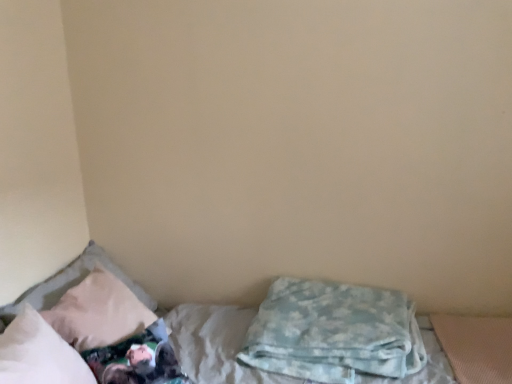
Question: From a real-world perspective, is white soft bed at lower left positioned over white soft pillow at left, which is the third pillow from right to left, based on gravity?

Choices:
 (A) yes
 (B) no

Answer: (B)

Question: Is white soft bed at lower left next to white soft pillow at left, which is the third pillow from right to left?

Choices:
 (A) no
 (B) yes

Answer: (A)

Question: Does white soft bed at lower left have a larger size compared to white soft pillow at left, which is the third pillow from right to left?

Choices:
 (A) yes
 (B) no

Answer: (A)

Question: Does white soft bed at lower left lie in front of white soft pillow at left, arranged as the first pillow when viewed from the left?

Choices:
 (A) no
 (B) yes

Answer: (B)

Question: Does white soft bed at lower left have a greater height compared to white soft pillow at left, arranged as the first pillow when viewed from the left?

Choices:
 (A) yes
 (B) no

Answer: (A)

Question: Does white soft bed at lower left have a smaller size compared to white soft pillow at left, which is the third pillow from right to left?

Choices:
 (A) no
 (B) yes

Answer: (A)

Question: Does white soft pillow at left, arranged as the first pillow when viewed from the left, have a smaller size compared to white soft bed at lower left?

Choices:
 (A) no
 (B) yes

Answer: (B)

Question: Is white soft pillow at left, which is the third pillow from right to left, at the right side of white soft bed at lower left?

Choices:
 (A) yes
 (B) no

Answer: (B)

Question: From a real-world perspective, is white soft pillow at left, arranged as the first pillow when viewed from the left, located higher than white soft bed at lower left?

Choices:
 (A) yes
 (B) no

Answer: (A)

Question: From the image's perspective, would you say white soft pillow at left, which is the third pillow from right to left, is shown under white soft bed at lower left?

Choices:
 (A) no
 (B) yes

Answer: (A)

Question: Does white soft pillow at left, which is the third pillow from right to left, appear on the left side of white soft bed at lower left?

Choices:
 (A) no
 (B) yes

Answer: (B)

Question: Is white soft pillow at left, arranged as the first pillow when viewed from the left, closer to the viewer compared to white soft bed at lower left?

Choices:
 (A) no
 (B) yes

Answer: (A)

Question: Can you confirm if blue soft blanket at lower right, placed as the 1th pillow when sorted from right to left, is thinner than white soft pillow at left, which is the third pillow from right to left?

Choices:
 (A) no
 (B) yes

Answer: (A)